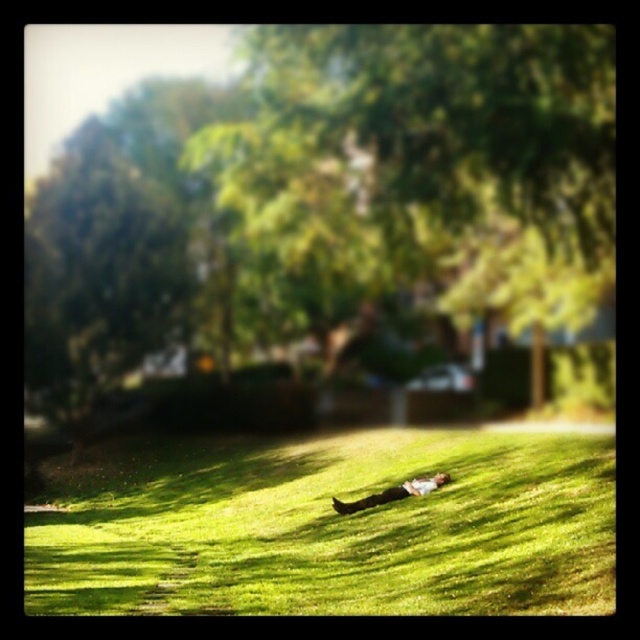
Who is taller, green leafy tree at center or green grass at lower center?

green leafy tree at center is taller.

Does green leafy tree at center come in front of green grass at lower center?

That is False.

Is point (508, 90) closer to camera compared to point (260, 504)?

No, (508, 90) is further to viewer.

Locate an element on the screen. The image size is (640, 640). green leafy tree at center is located at coordinates (428, 168).

Is point (440, 566) positioned in front of point (355, 506)?

Yes, point (440, 566) is closer to viewer.

Does green grass at lower center lie behind light brown leather jacket at center?

No, green grass at lower center is in front of light brown leather jacket at center.

Where is `green grass at lower center`? The image size is (640, 640). green grass at lower center is located at coordinates (333, 529).

Where is `green grass at lower center`? The width and height of the screenshot is (640, 640). green grass at lower center is located at coordinates (333, 529).

Is point (611, 227) positioned after point (403, 493)?

That is True.

Does green leafy tree at center appear on the right side of light brown leather jacket at center?

Indeed, green leafy tree at center is positioned on the right side of light brown leather jacket at center.

Is point (280, 131) less distant than point (336, 504)?

No, it is not.

At what (x,y) coordinates should I click in order to perform the action: click on green leafy tree at center. Please return your answer as a coordinate pair (x, y). The width and height of the screenshot is (640, 640). Looking at the image, I should click on (428, 168).